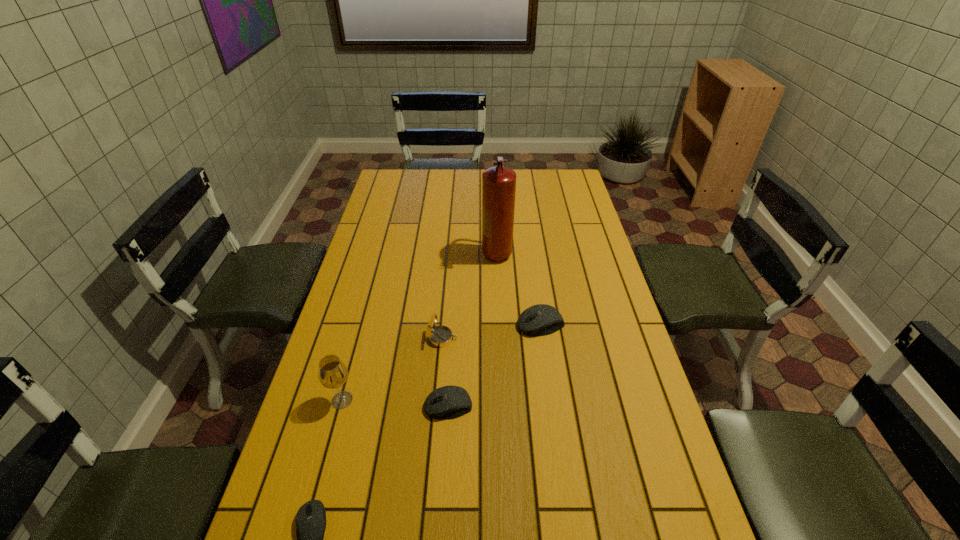
All computer equipments are currently evenly spaced. To continue this pattern, where would you add another computer equipment on the right? Please point out a vacant spot. Please provide its 2D coordinates. Your answer should be formatted as a tuple, i.e. [(x, y)], where the tuple contains the x and y coordinates of a point satisfying the conditions above.

[(608, 265)]